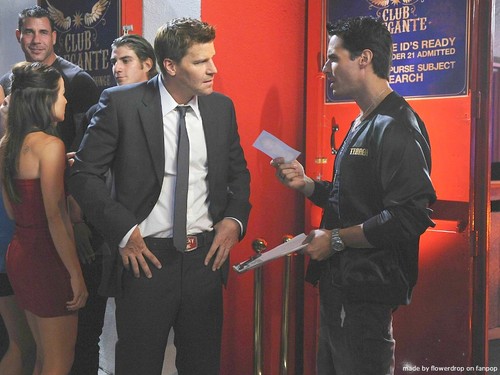
Where is `wall`? The width and height of the screenshot is (500, 375). wall is located at coordinates (171, 9).